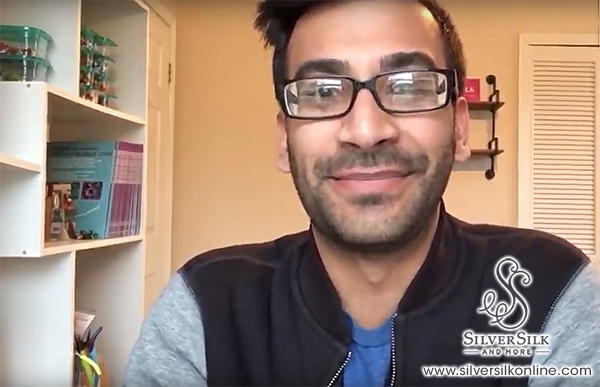
Where is `white door`? The image size is (600, 387). white door is located at coordinates (157, 234).